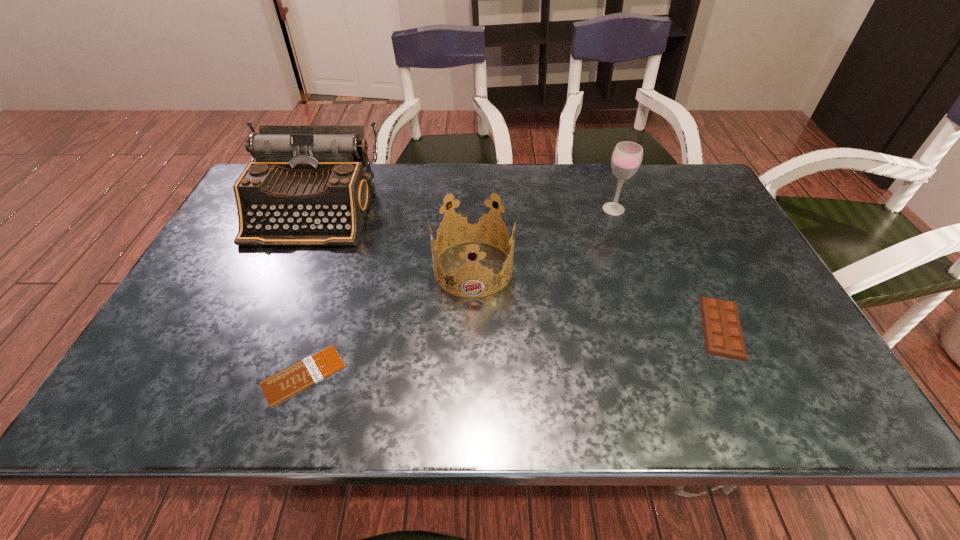
The image size is (960, 540). I want to click on free space between the right chocolate bar and the crown, so click(597, 298).

Where is `free space between the right chocolate bar and the crown`? This screenshot has height=540, width=960. free space between the right chocolate bar and the crown is located at coordinates (597, 298).

Identify which object is the fourth nearest to the typewriter. Please provide its 2D coordinates. Your answer should be formatted as a tuple, i.e. [(x, y)], where the tuple contains the x and y coordinates of a point satisfying the conditions above.

[(723, 336)]

Identify the location of object that stands as the closest to the second shortest object. (627, 156).

Where is `free location that satisfies the following two spatial constraints: 1. on the keyboard of the typewriter; 2. on the left side of the shorter chocolate bar`? free location that satisfies the following two spatial constraints: 1. on the keyboard of the typewriter; 2. on the left side of the shorter chocolate bar is located at coordinates (242, 375).

Where is `free location that satisfies the following two spatial constraints: 1. on the keyboard of the fourth object from left to right; 2. on the right side of the typewriter`? The image size is (960, 540). free location that satisfies the following two spatial constraints: 1. on the keyboard of the fourth object from left to right; 2. on the right side of the typewriter is located at coordinates (313, 209).

This screenshot has width=960, height=540. I want to click on free location that satisfies the following two spatial constraints: 1. on the keyboard of the shorter chocolate bar; 2. on the left side of the typewriter, so click(242, 375).

This screenshot has height=540, width=960. I want to click on vacant area that satisfies the following two spatial constraints: 1. on the keyboard of the typewriter; 2. on the right side of the shorter chocolate bar, so click(x=242, y=375).

I want to click on free space that satisfies the following two spatial constraints: 1. on the keyboard of the third object from right to left; 2. on the left side of the typewriter, so click(287, 268).